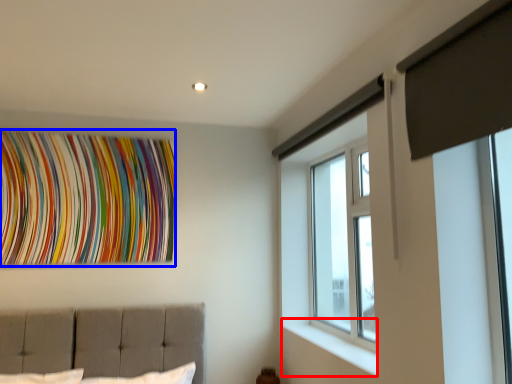
Question: Which object appears farthest to the camera in this image, window sill (highlighted by a red box) or tapestry (highlighted by a blue box)?

Choices:
 (A) window sill
 (B) tapestry

Answer: (B)